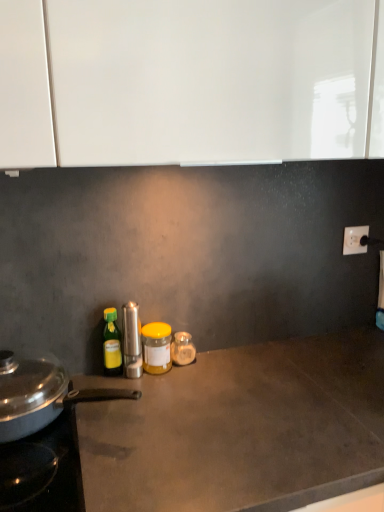
Image resolution: width=384 pixels, height=512 pixels. Identify the location of vacant location below metallic silver pan at left, which appears as the first kitchen appliance when viewed from the left (from a real-world perspective). (82, 414).